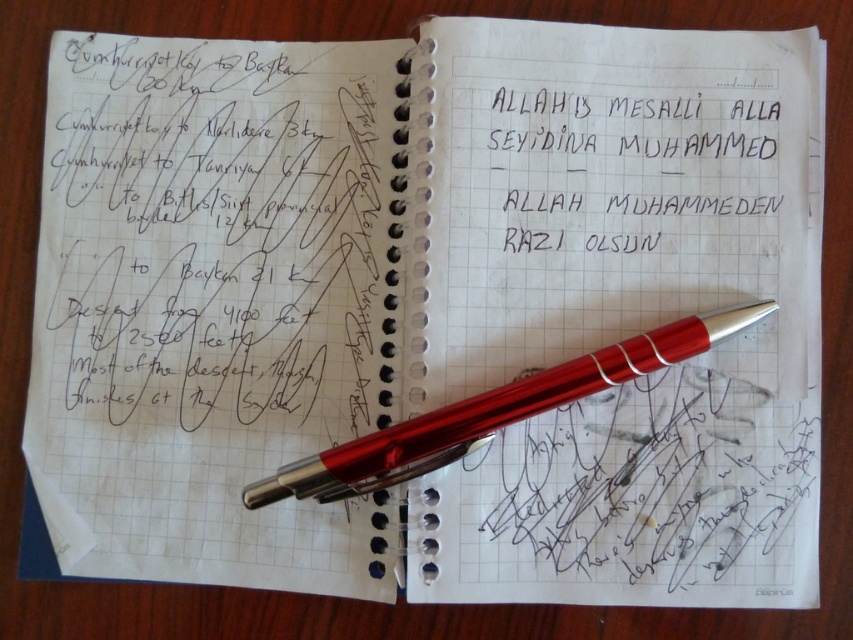
You are an office assistant who needs to write a letter. You see the metallic red pen at center and the black handwritten text at upper right. Which object is taller?

The metallic red pen at center is taller than the black handwritten text at upper right.

You are an office assistant who needs to write a letter. You have a metallic red pen at center and black handwritten text at upper right. Which object is closer to you?

The metallic red pen at center is closer to you since the black handwritten text at upper right is 4.29 inches away from it.